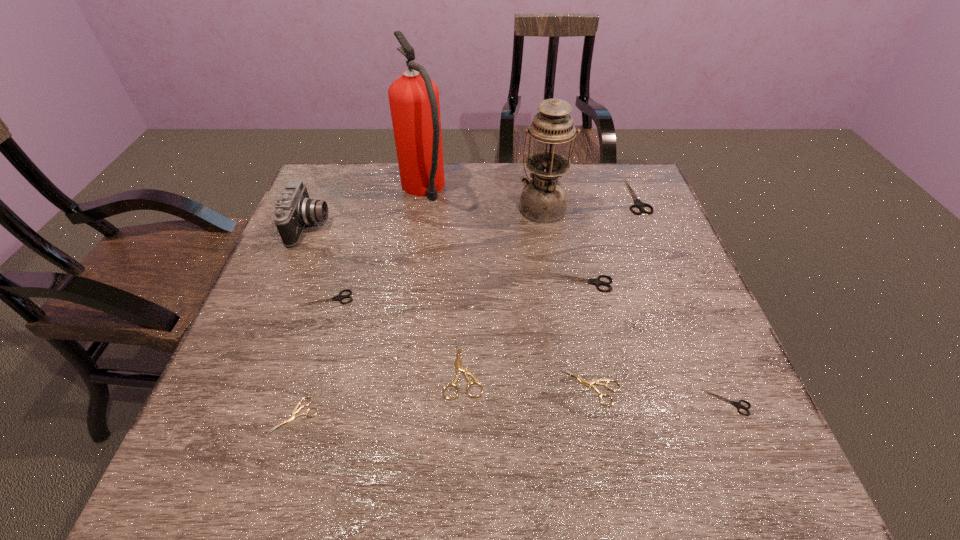
In order to click on the second beige shears from right to left in this screenshot , I will do `click(459, 367)`.

Image resolution: width=960 pixels, height=540 pixels. Identify the location of the sixth object from right to left. (459, 367).

Image resolution: width=960 pixels, height=540 pixels. I want to click on the rightmost beige shears, so click(589, 383).

Locate an element on the screen. the nearest black shears is located at coordinates point(738,404).

You are a GUI agent. You are given a task and a screenshot of the screen. Output one action in this format:
    pyautogui.click(x=<x>, y=<y>)
    Task: Click on the shortest shears
    
    Given the screenshot: What is the action you would take?
    pyautogui.click(x=296, y=410)

Identify the location of the leftmost beige shears. This screenshot has width=960, height=540. 296,410.

You are a GUI agent. You are given a task and a screenshot of the screen. Output one action in this format:
    pyautogui.click(x=<x>, y=<y>)
    Task: Click on the vacant position located on the right of the oil lamp
    The height and width of the screenshot is (540, 960).
    Given the screenshot: What is the action you would take?
    pyautogui.click(x=604, y=207)

I want to click on vacant space located 0.180m on the front-facing side of the black camera, so click(393, 226).

Find the location of `vacant point located 0.160m on the left of the seventh shortest object`. vacant point located 0.160m on the left of the seventh shortest object is located at coordinates (571, 196).

Identify the location of vacant space located on the right of the second black shears from left to right. The width and height of the screenshot is (960, 540). (674, 283).